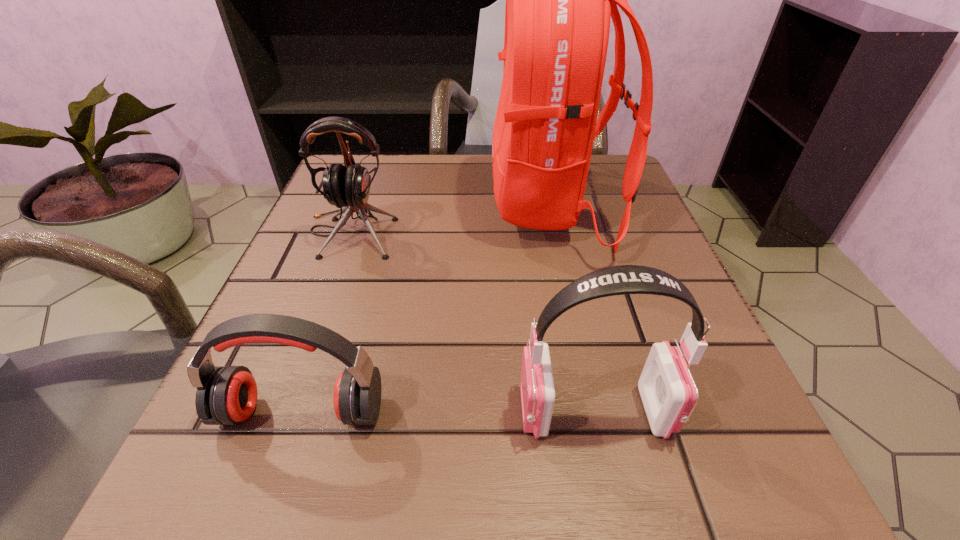
Identify the location of free space at the near edge of the desktop. This screenshot has height=540, width=960. (414, 464).

I want to click on free space at the left edge, so click(x=323, y=364).

Where is `free region at the right edge`? The image size is (960, 540). free region at the right edge is located at coordinates (614, 251).

This screenshot has height=540, width=960. Find the location of `free region at the near left corner of the desktop`. free region at the near left corner of the desktop is located at coordinates (270, 469).

The height and width of the screenshot is (540, 960). In order to click on vacant space at the near right corner of the desktop in this screenshot , I will do `click(770, 460)`.

Find the location of a particular element. This screenshot has width=960, height=540. free space between the rightmost earphone and the tallest object is located at coordinates 572,309.

Identify the location of free space between the farthest earphone and the shortest earphone. The image size is (960, 540). (326, 322).

The width and height of the screenshot is (960, 540). What are the coordinates of `free space between the shortest earphone and the tallest object` in the screenshot? It's located at (426, 309).

Locate an element on the screen. free space between the shortest object and the tallest object is located at coordinates (426, 309).

This screenshot has width=960, height=540. Identify the location of empty space between the rightmost earphone and the backpack. pyautogui.click(x=572, y=309).